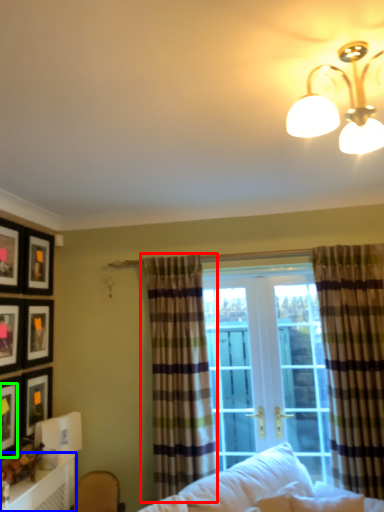
Question: Considering the real-world distances, which object is farthest from curtain (highlighted by a red box)? table (highlighted by a blue box) or picture frame (highlighted by a green box)?

Choices:
 (A) table
 (B) picture frame

Answer: (B)